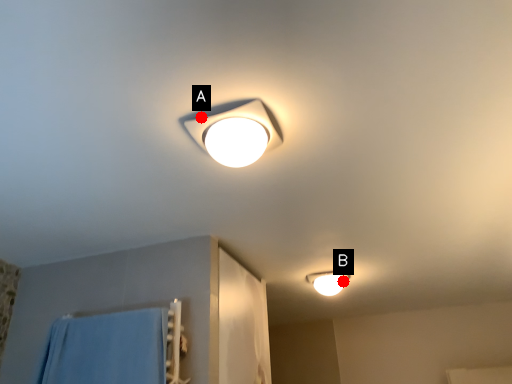
Question: Two points are circled on the image, labeled by A and B beside each circle. Which point appears farthest from the camera in this image?

Choices:
 (A) A is further
 (B) B is further

Answer: (B)